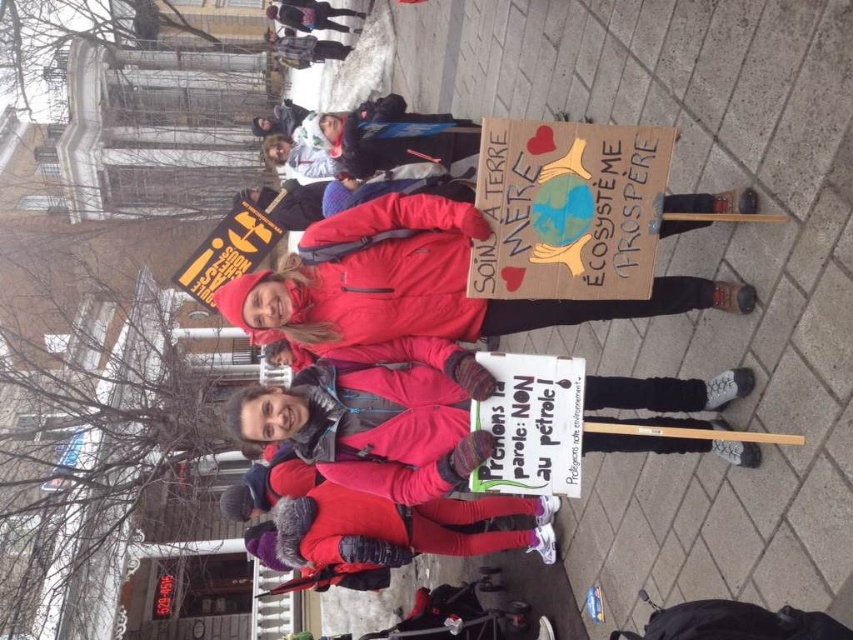
Is matte red jacket at center bigger than red knit hat at upper center?

Indeed, matte red jacket at center has a larger size compared to red knit hat at upper center.

Does matte red jacket at center lie behind red knit hat at upper center?

That is False.

Is point (370, 202) positioned behind point (312, 26)?

No, (370, 202) is closer to viewer.

You are a GUI agent. You are given a task and a screenshot of the screen. Output one action in this format:
    pyautogui.click(x=<x>, y=<y>)
    Task: Click on the matte red jacket at center
    
    Given the screenshot: What is the action you would take?
    click(421, 284)

How much distance is there between green paper sign at center and red knit hat at upper center?

green paper sign at center is 17.56 meters away from red knit hat at upper center.

Can you confirm if green paper sign at center is bigger than red knit hat at upper center?

Incorrect, green paper sign at center is not larger than red knit hat at upper center.

Between point (532, 426) and point (268, 6), which one is positioned in front?

Point (532, 426) is in front.

Find the location of `green paper sign at center`. green paper sign at center is located at coordinates (531, 424).

Measure the distance from matte red jacket at center to green paper sign at center.

matte red jacket at center and green paper sign at center are 39.16 inches apart.

Is matte red jacket at center further to the viewer compared to green paper sign at center?

Yes, it is.

Between point (714, 204) and point (524, 358), which one is positioned in front?

Point (524, 358) is in front.

Identify the location of matte red jacket at center. (421, 284).